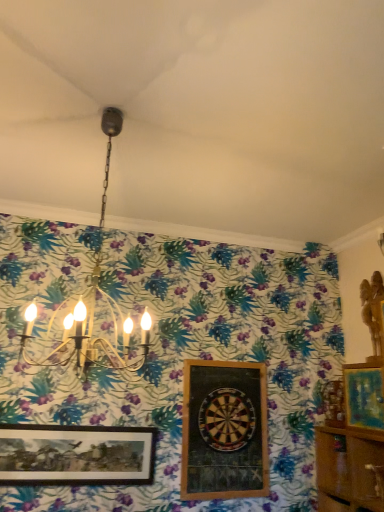
Question: Is gold metallic chandelier at upper center at the left side of wooden cabinet at lower right?

Choices:
 (A) yes
 (B) no

Answer: (A)

Question: From a real-world perspective, is gold metallic chandelier at upper center below wooden cabinet at lower right?

Choices:
 (A) yes
 (B) no

Answer: (B)

Question: From the image's perspective, is gold metallic chandelier at upper center located beneath wooden cabinet at lower right?

Choices:
 (A) yes
 (B) no

Answer: (B)

Question: From the image's perspective, would you say gold metallic chandelier at upper center is positioned over wooden cabinet at lower right?

Choices:
 (A) yes
 (B) no

Answer: (A)

Question: Is gold metallic chandelier at upper center thinner than wooden cabinet at lower right?

Choices:
 (A) yes
 (B) no

Answer: (B)

Question: Can you confirm if gold metallic chandelier at upper center is bigger than wooden cabinet at lower right?

Choices:
 (A) no
 (B) yes

Answer: (B)

Question: From the image's perspective, is wooden framed picture at lower left, the 1th picture frame when ordered from left to right, over teal matte painting at right, the 3th picture frame viewed from the left?

Choices:
 (A) no
 (B) yes

Answer: (A)

Question: Is wooden framed picture at lower left, the 1th picture frame when ordered from left to right, next to teal matte painting at right, the 3th picture frame viewed from the left, and touching it?

Choices:
 (A) yes
 (B) no

Answer: (B)

Question: Could teal matte painting at right, the first picture frame viewed from the right, be considered to be inside wooden framed picture at lower left, placed as the third picture frame when sorted from right to left?

Choices:
 (A) no
 (B) yes

Answer: (A)

Question: Is wooden framed picture at lower left, placed as the third picture frame when sorted from right to left, smaller than teal matte painting at right, the first picture frame viewed from the right?

Choices:
 (A) no
 (B) yes

Answer: (B)

Question: Is wooden framed picture at lower left, the 1th picture frame when ordered from left to right, aimed at teal matte painting at right, the 3th picture frame viewed from the left?

Choices:
 (A) yes
 (B) no

Answer: (B)

Question: From a real-world perspective, is wooden framed picture at lower left, placed as the third picture frame when sorted from right to left, located beneath teal matte painting at right, the 3th picture frame viewed from the left?

Choices:
 (A) no
 (B) yes

Answer: (B)

Question: Does gold metallic chandelier at upper center turn towards wooden dartboard at center?

Choices:
 (A) yes
 (B) no

Answer: (B)